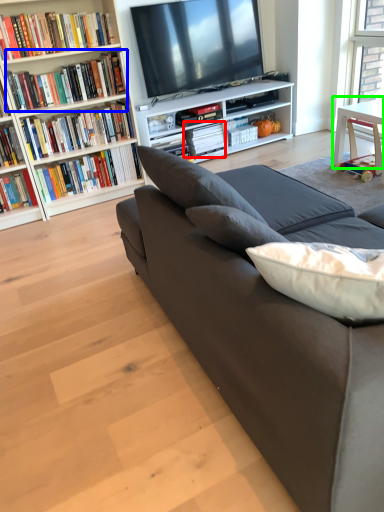
Question: Considering the real-world distances, which object is farthest from book (highlighted by a red box)? book (highlighted by a blue box) or table (highlighted by a green box)?

Choices:
 (A) book
 (B) table

Answer: (B)